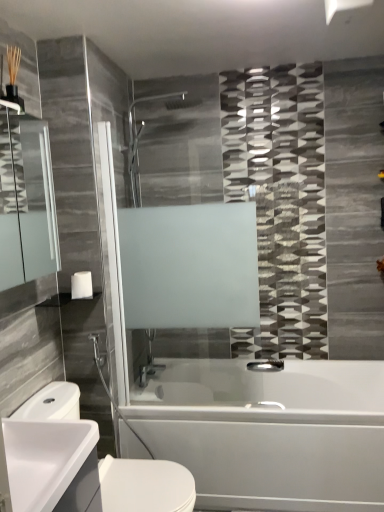
Question: Is white glossy bathtub at lower center with white glossy sink at lower left?

Choices:
 (A) no
 (B) yes

Answer: (A)

Question: Would you say white glossy bathtub at lower center contains white glossy sink at lower left?

Choices:
 (A) yes
 (B) no

Answer: (B)

Question: Can you confirm if white glossy bathtub at lower center is taller than white glossy sink at lower left?

Choices:
 (A) no
 (B) yes

Answer: (B)

Question: Does white glossy bathtub at lower center have a smaller size compared to white glossy sink at lower left?

Choices:
 (A) yes
 (B) no

Answer: (B)

Question: From a real-world perspective, does white glossy bathtub at lower center sit lower than white glossy sink at lower left?

Choices:
 (A) yes
 (B) no

Answer: (A)

Question: Could you tell me if white glossy bathtub at lower center is turned towards white glossy sink at lower left?

Choices:
 (A) no
 (B) yes

Answer: (A)

Question: From the image's perspective, is matte glass mirror at left under white glossy bathtub at lower center?

Choices:
 (A) yes
 (B) no

Answer: (B)

Question: Is matte glass mirror at left closer to camera compared to white glossy bathtub at lower center?

Choices:
 (A) yes
 (B) no

Answer: (A)

Question: Would you consider matte glass mirror at left to be distant from white glossy bathtub at lower center?

Choices:
 (A) yes
 (B) no

Answer: (A)

Question: Does matte glass mirror at left appear on the left side of white glossy bathtub at lower center?

Choices:
 (A) no
 (B) yes

Answer: (B)

Question: Can you confirm if matte glass mirror at left is positioned to the right of white glossy bathtub at lower center?

Choices:
 (A) yes
 (B) no

Answer: (B)

Question: Is matte glass mirror at left oriented away from white glossy bathtub at lower center?

Choices:
 (A) yes
 (B) no

Answer: (B)

Question: Is white glossy towel bar at upper left inside white glossy bathtub at lower center?

Choices:
 (A) yes
 (B) no

Answer: (B)